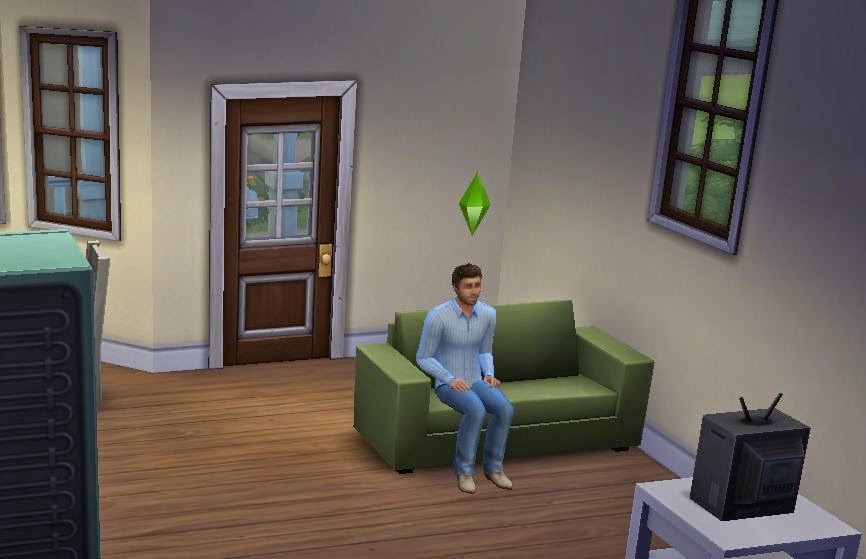
Where is `door`? The height and width of the screenshot is (559, 866). door is located at coordinates (265, 257).